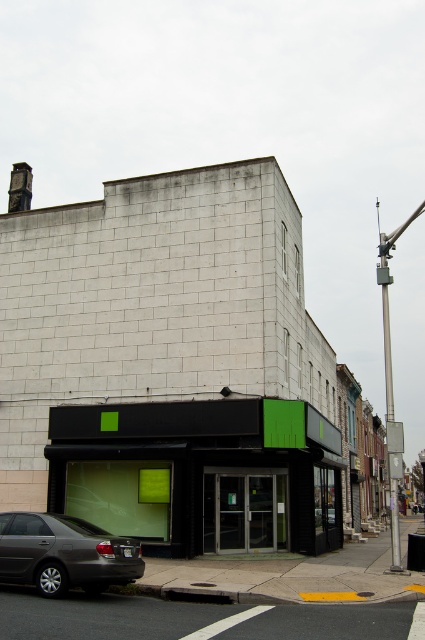
You are standing on the sidewalk in front of the building and want to walk from point (42, 525) to point (274, 483). Is the destination point behind the parked sedan?

Point (274, 483) is behind point (42, 525), so yes, the destination point is behind the parked sedan.

You are a delivery person trying to park your van in front of the black matte storefront at lower center. The matte gray sedan at lower left is blocking part of the parking space. Can you estimate whether the remaining space is enough for your van, which is 6 meters long?

The black matte storefront at lower center is larger in size than the matte gray sedan at lower left. However, the exact dimensions of the parking space and the sedan are not provided, so it is impossible to determine if the remaining space is sufficient for a 6 meter van.

You are a delivery person needing to access the black matte storefront at lower center. You see the matte gray sedan at lower left blocking the entrance. Can you walk around the sedan to reach the storefront?

The black matte storefront at lower center is positioned on the right side of the matte gray sedan at lower left, so you can walk around the sedan to the right side to access the storefront.